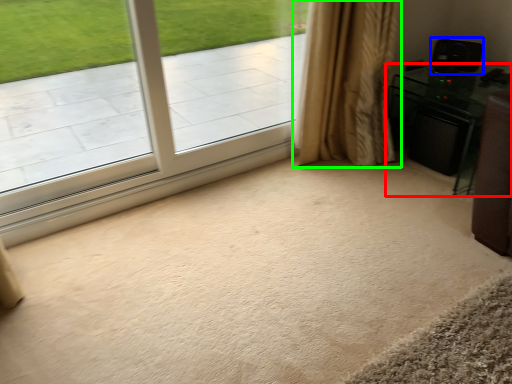
Question: Estimate the real-world distances between objects in this image. Which object is closer to furniture (highlighted by a red box), speaker (highlighted by a blue box) or curtain (highlighted by a green box)?

Choices:
 (A) speaker
 (B) curtain

Answer: (A)